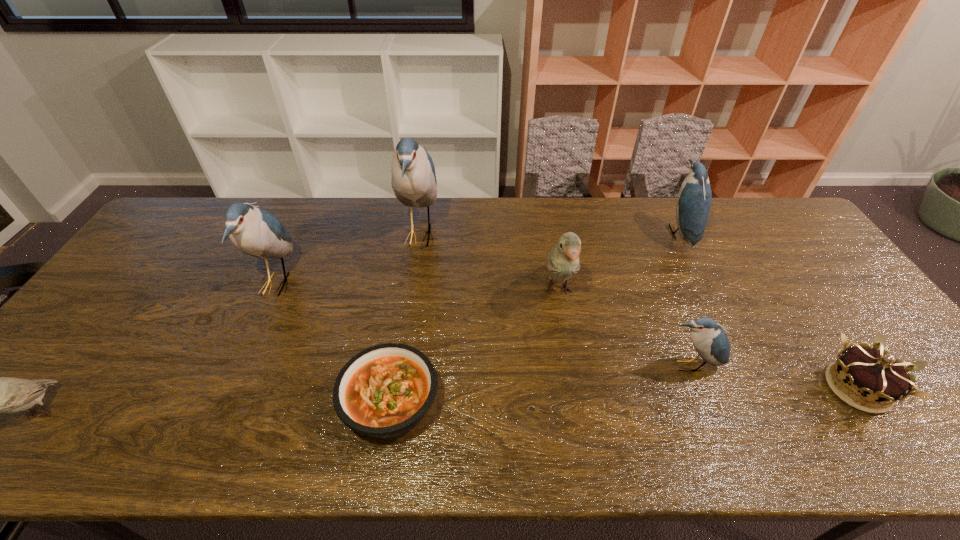
Where is `the fourth bird from right to left`? Image resolution: width=960 pixels, height=540 pixels. the fourth bird from right to left is located at coordinates (414, 183).

Find the location of a particular element. The width and height of the screenshot is (960, 540). the tallest bird is located at coordinates (414, 183).

At what (x,y) coordinates should I click in order to perform the action: click on the second object from left to right. Please return your answer as a coordinate pair (x, y). Image resolution: width=960 pixels, height=540 pixels. Looking at the image, I should click on (254, 231).

At what (x,y) coordinates should I click in order to perform the action: click on the fifth shortest bird. Please return your answer as a coordinate pair (x, y). Image resolution: width=960 pixels, height=540 pixels. Looking at the image, I should click on (254, 231).

Where is `the rightmost blue bird`? This screenshot has width=960, height=540. the rightmost blue bird is located at coordinates (694, 198).

Find the location of a particular element. Image resolution: width=960 pixels, height=540 pixels. the third biggest blue bird is located at coordinates (694, 198).

Locate an element on the screen. This screenshot has height=540, width=960. the fourth object from right to left is located at coordinates click(563, 260).

Find the location of a particular element. the bigger white bird is located at coordinates (563, 260).

Where is `the sixth object from left to right`? the sixth object from left to right is located at coordinates (708, 338).

The width and height of the screenshot is (960, 540). Identify the location of the smallest blue bird. (708, 338).